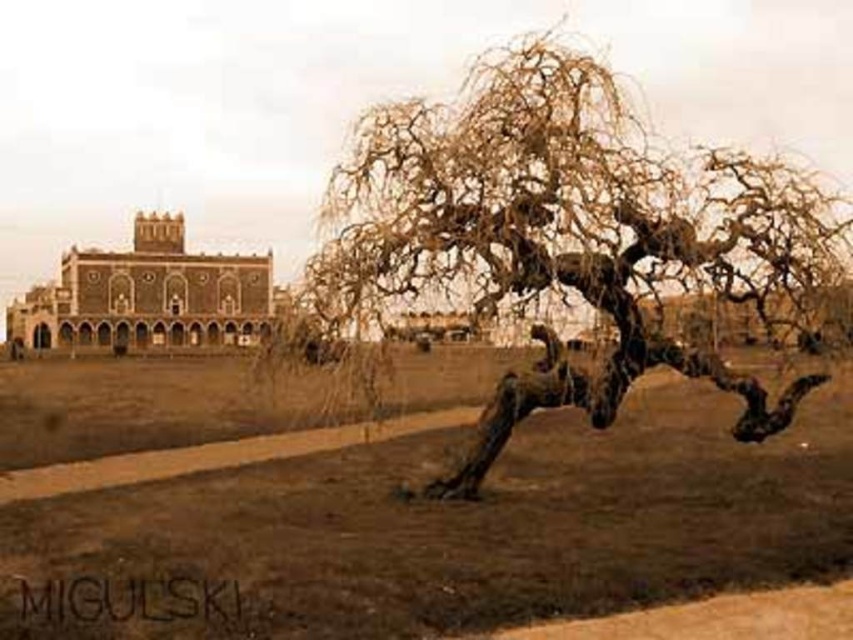
Which is in front, point (583, 67) or point (61, 320)?

Point (583, 67)

Does brown textured tree at center have a greater width compared to brown stone palace at upper left?

Yes, brown textured tree at center is wider than brown stone palace at upper left.

The height and width of the screenshot is (640, 853). Describe the element at coordinates (566, 230) in the screenshot. I see `brown textured tree at center` at that location.

The image size is (853, 640). What are the coordinates of `brown textured tree at center` in the screenshot? It's located at (566, 230).

Is point (141, 582) closer to viewer compared to point (691, 157)?

Yes.

Measure the distance between brown dirt field at center and camera.

They are 100.29 meters apart.

The width and height of the screenshot is (853, 640). In order to click on brown dirt field at center in this screenshot , I will do `click(401, 502)`.

Is point (135, 566) closer to camera compared to point (86, 312)?

Yes, point (135, 566) is closer to viewer.

Is brown dirt field at center to the right of brown stone palace at upper left from the viewer's perspective?

Correct, you'll find brown dirt field at center to the right of brown stone palace at upper left.

Who is more distant from viewer, (735,532) or (102,257)?

Point (102,257)

Find the location of a particular element. brown dirt field at center is located at coordinates (401, 502).